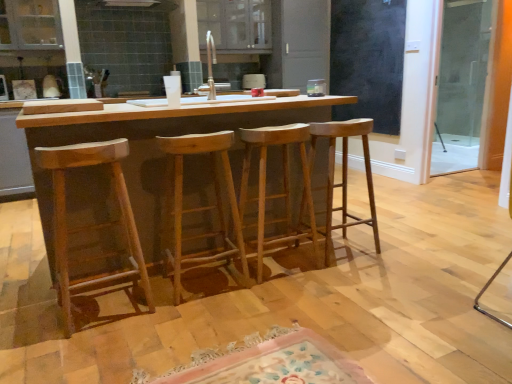
Find the location of a particular element. free space in front of transparent glass screen door at right, the 1th screen door in the right-to-left sequence is located at coordinates (470, 185).